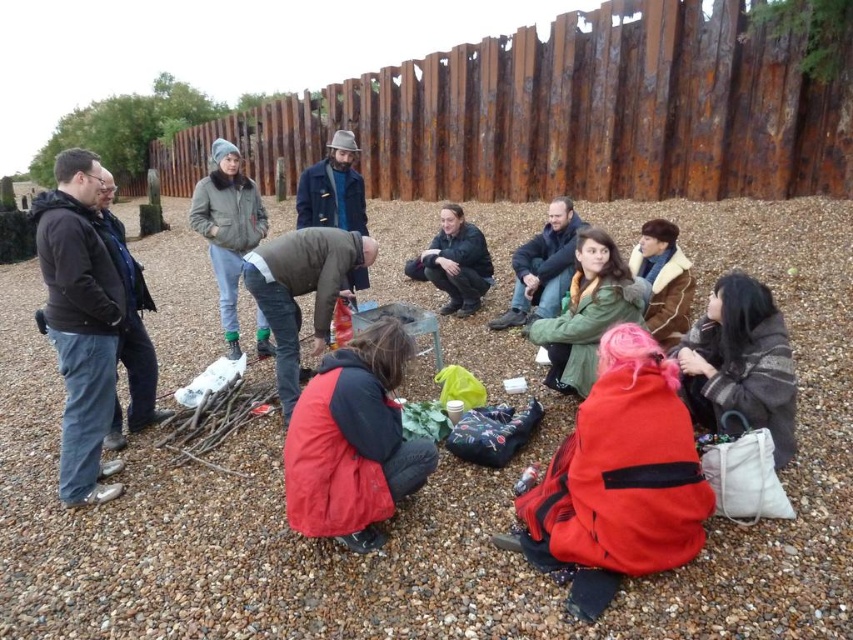
Consider the image. You are standing at the point with coordinates point (456,262). What object is located at that point?

The point (456,262) corresponds to the matte black jacket at center.

You are standing in the scene and want to move from the point at coordinates point (730, 140) to the point at coordinates point (218, 292). Which direction should you move to get closer to the camera?

To move closer to the camera, you should move towards point (218, 292) because it is closer to the camera than point (730, 140).

You are part of the group near the fire pit and want to move closer to the rusty metal fence at upper center. Which direction should you move relative to the gray fuzzy jacket at center?

You should move to the left of the gray fuzzy jacket at center to reach the rusty metal fence at upper center since it is located to the left of the jacket.